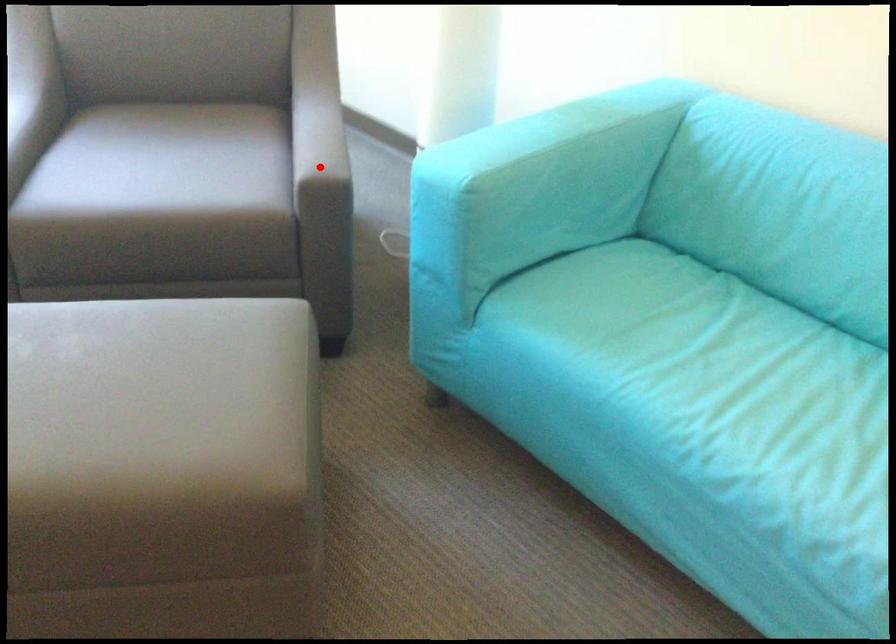
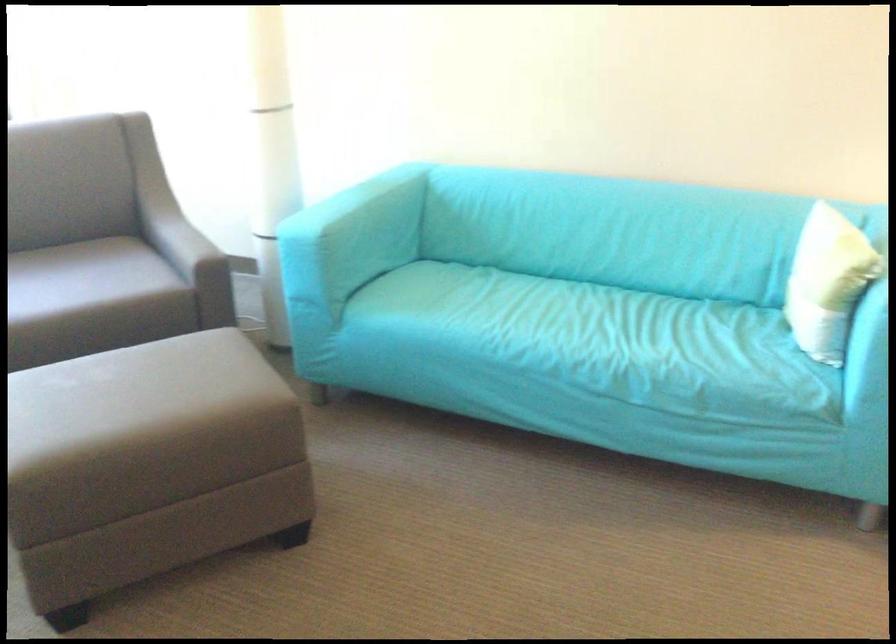
Question: I am providing you with two images of the same scene from different viewpoints. A red point is shown in image1. For the corresponding object point in image2, is it positioned nearer or farther from the camera?

Choices:
 (A) Nearer
 (B) Farther

Answer: (B)